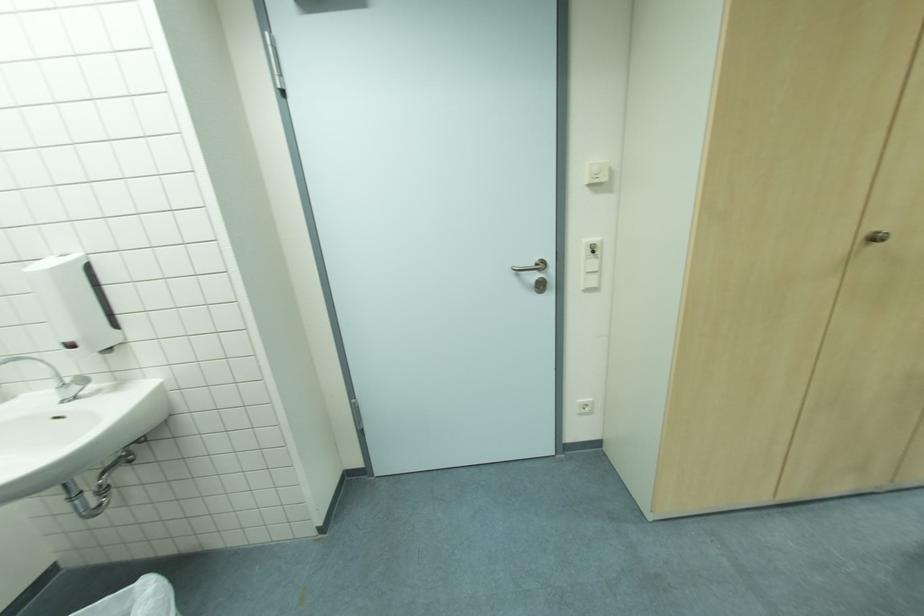
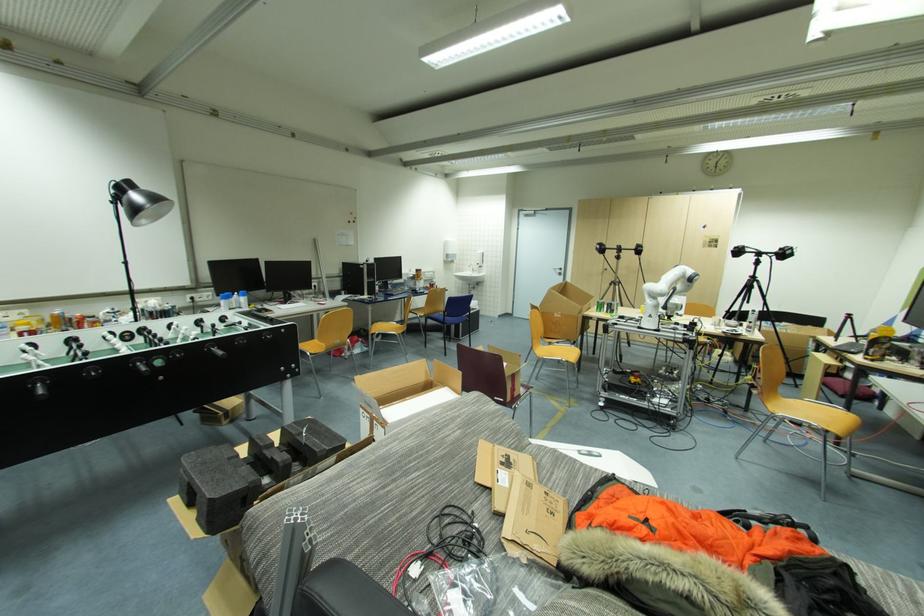
The point at (x=526, y=283) is marked in the first image. Where is the corresponding point in the second image?

(560, 273)